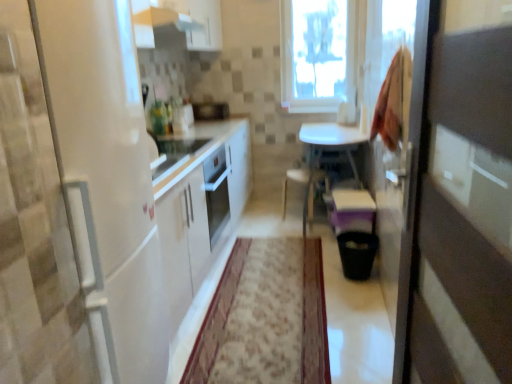
You are a GUI agent. You are given a task and a screenshot of the screen. Output one action in this format:
    pyautogui.click(x=<x>, y=<y>)
    Task: Click on the free space that is to the left of wooden chair at center
    Image resolution: width=512 pixels, height=384 pixels.
    Given the screenshot: What is the action you would take?
    pyautogui.click(x=260, y=223)